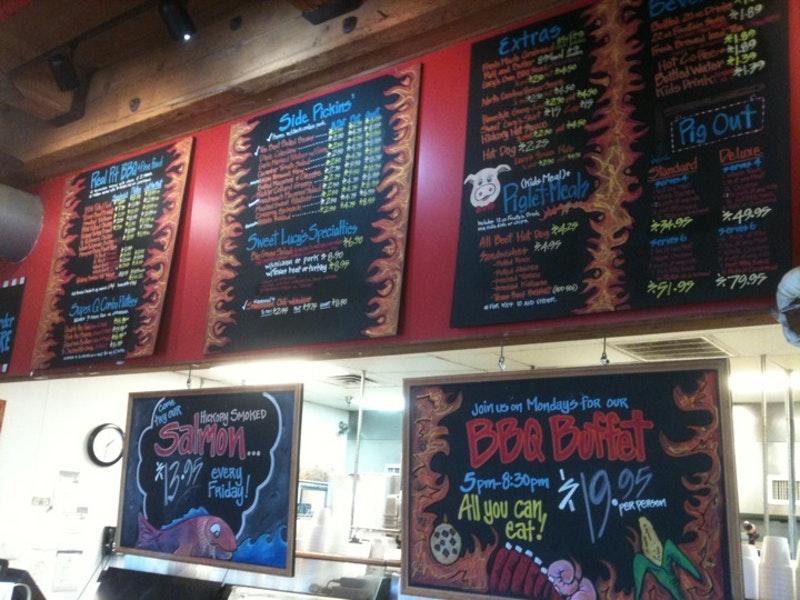
Locate an element on the screen. Image resolution: width=800 pixels, height=600 pixels. restaurant kitchen is located at coordinates (354, 493), (754, 471).